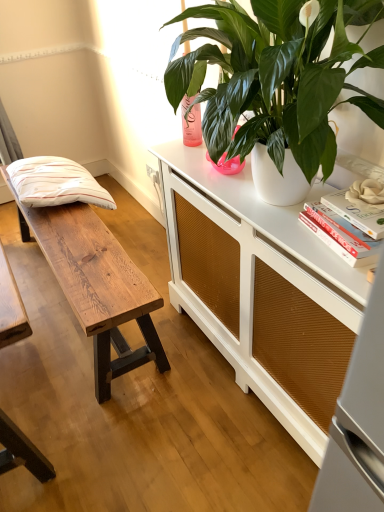
The width and height of the screenshot is (384, 512). I want to click on vacant area that is in front of white textured cabinet at center, so click(x=223, y=452).